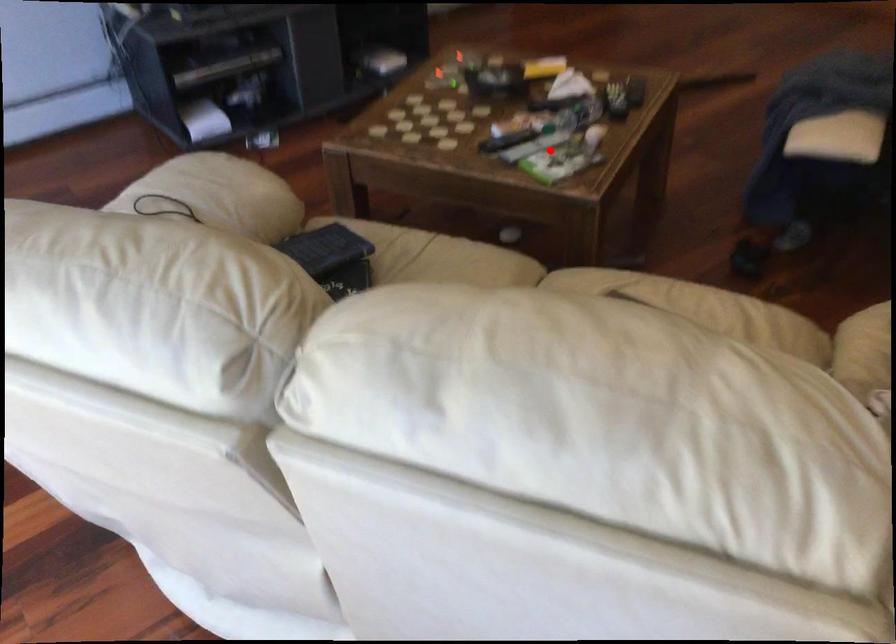
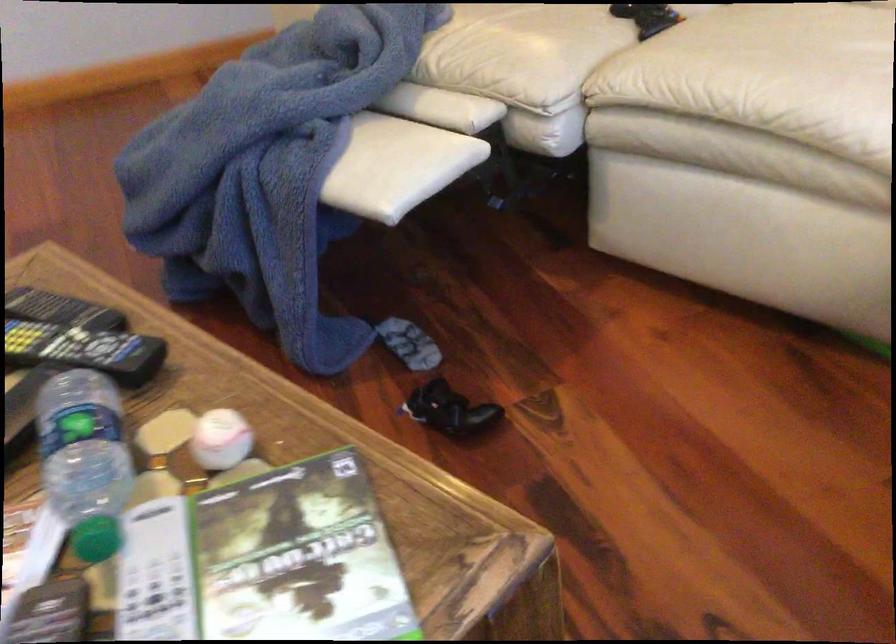
Question: I am providing you with two images of the same scene from different viewpoints. Given a red point in image1, look at the same physical point in image2. Is it:

Choices:
 (A) Closer to the viewpoint
 (B) Farther from the viewpoint

Answer: (A)